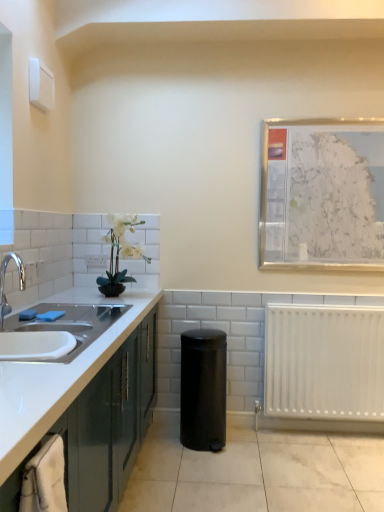
Identify the location of free space underneath white plastic radiator at lower right (from a real-world perspective). coord(337,430).